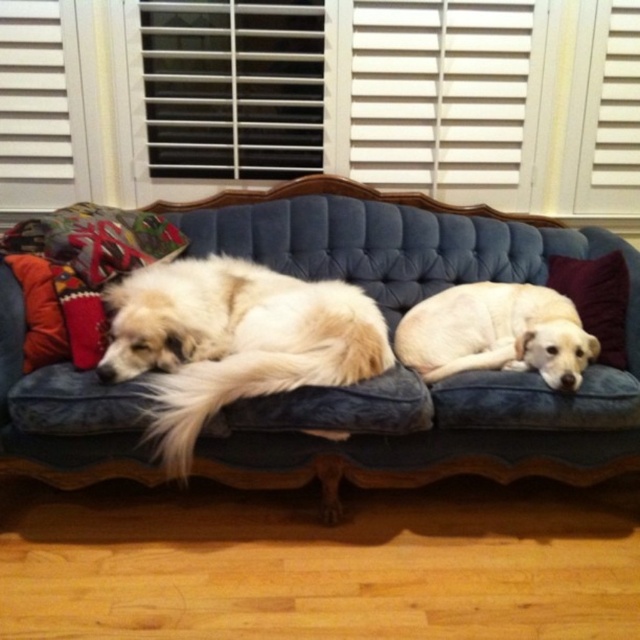
You are a photographer trying to capture both the white fluffy dog at left and the light yellow fur at center in a single shot. Based on their positions, which dog should you focus on first to ensure both are in frame?

The white fluffy dog at left is positioned on the left side of light yellow fur at center, so you should focus on the white fluffy dog at left first to ensure both are in frame.

Based on the scene description, where is the white fluffy dog at left located in the image?

The white fluffy dog at left is located at point (x=234, y=340) in the image.

You are a dog owner who wants to place a new dog bed on the velvet blue couch at center. Considering the white fluffy dog at left is currently resting there, will the couch be able to support the dog bed without any issues?

The velvet blue couch at center is taller than the white fluffy dog at left, so it should have enough space to accommodate a dog bed without any issues.